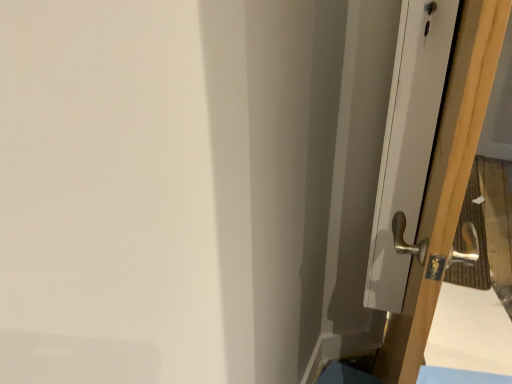
The height and width of the screenshot is (384, 512). Describe the element at coordinates (446, 182) in the screenshot. I see `white glossy door handle at right` at that location.

You are a GUI agent. You are given a task and a screenshot of the screen. Output one action in this format:
    pyautogui.click(x=<x>, y=<y>)
    Task: Click on the white glossy door handle at right
    This screenshot has width=512, height=384.
    Given the screenshot: What is the action you would take?
    pyautogui.click(x=446, y=182)

Where is `white glossy door handle at right`? This screenshot has width=512, height=384. white glossy door handle at right is located at coordinates (446, 182).